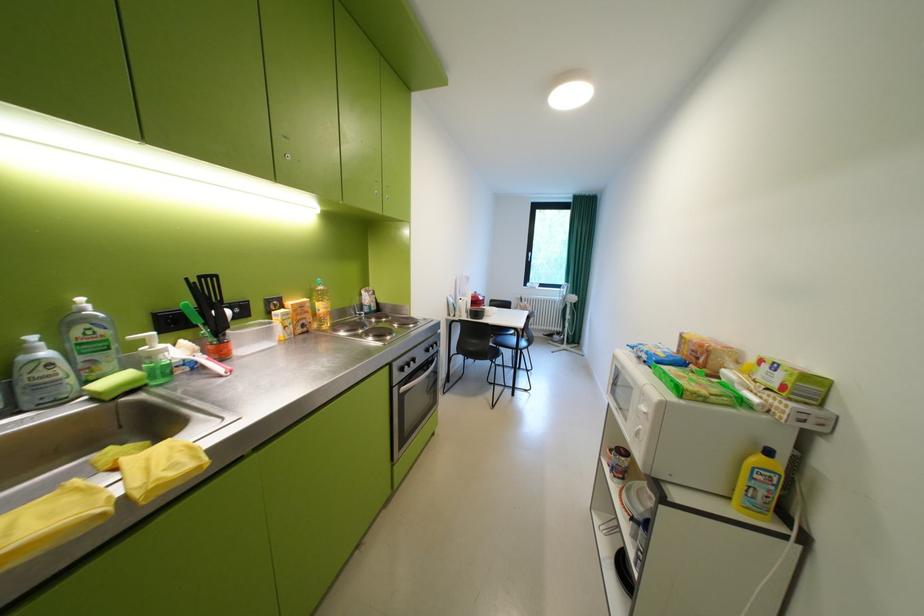
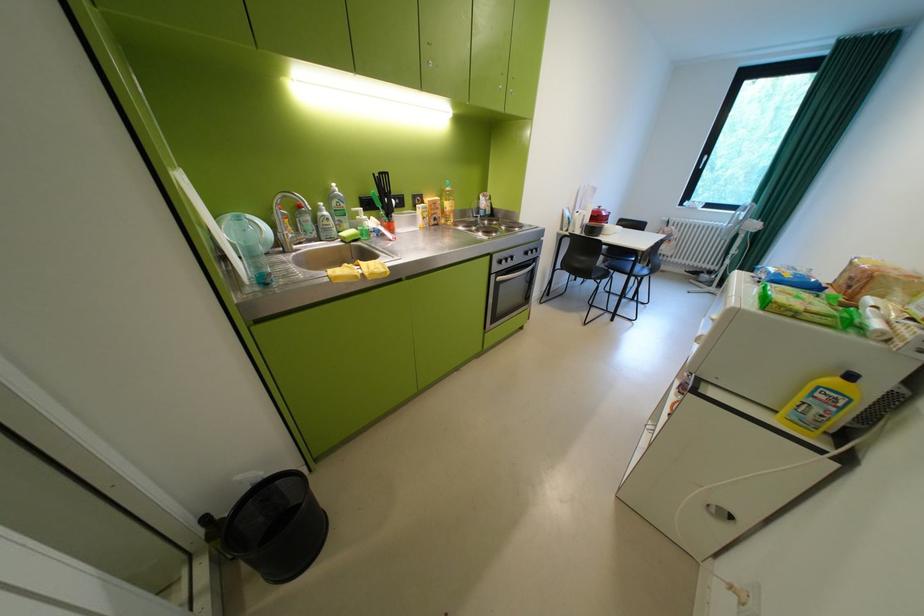
The point at (438, 351) is marked in the first image. Where is the corresponding point in the second image?

(537, 254)